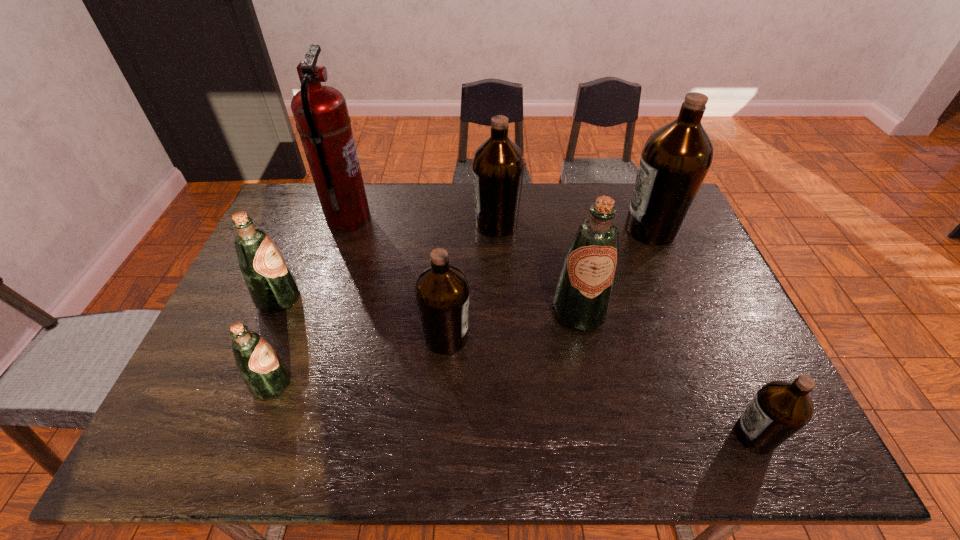
Find the location of a particular element. The height and width of the screenshot is (540, 960). vacant space at the far edge is located at coordinates (589, 198).

Where is `vacant space at the left edge`? Image resolution: width=960 pixels, height=540 pixels. vacant space at the left edge is located at coordinates (262, 330).

The height and width of the screenshot is (540, 960). Find the location of `free space at the right edge of the desktop`. free space at the right edge of the desktop is located at coordinates (672, 291).

You are a GUI agent. You are given a task and a screenshot of the screen. Output one action in this format:
    pyautogui.click(x=<x>, y=<y>)
    Task: Click on the vacant area that lies between the sixth object from left to right and the fire extinguisher
    Image resolution: width=960 pixels, height=540 pixels.
    Given the screenshot: What is the action you would take?
    pyautogui.click(x=464, y=265)

This screenshot has width=960, height=540. What are the coordinates of `vacant region between the sixth farthest olive oil and the second biggest green olive oil` in the screenshot? It's located at (276, 342).

Where is `free spot between the second biggest brown olive oil and the nearest object`? free spot between the second biggest brown olive oil and the nearest object is located at coordinates (626, 330).

The image size is (960, 540). Find the location of `vacant area that lies between the second smallest green olive oil and the nearest olive oil`. vacant area that lies between the second smallest green olive oil and the nearest olive oil is located at coordinates (516, 367).

Locate an element on the screen. This screenshot has height=540, width=960. empty location between the nearest olive oil and the second tallest object is located at coordinates (703, 332).

Where is `vacant region between the fire extinguisher and the nearest brown olive oil`? The width and height of the screenshot is (960, 540). vacant region between the fire extinguisher and the nearest brown olive oil is located at coordinates (551, 327).

Identify the location of vacant area that lies between the nearest object and the second biggest green olive oil. (516, 367).